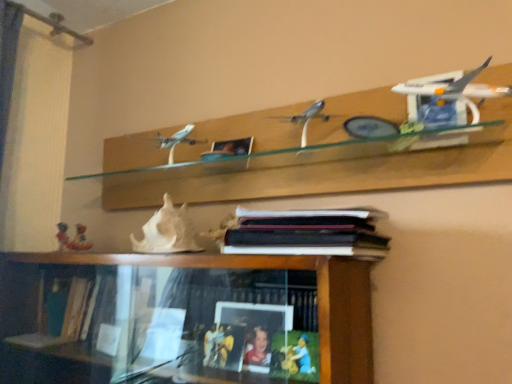
Question: Is matte plastic toy at lower left, which is the first toy in back-to-front order, far from white glossy airplane at upper right?

Choices:
 (A) yes
 (B) no

Answer: (A)

Question: Is matte plastic toy at lower left, the 1th toy from the left, facing away from white glossy airplane at upper right?

Choices:
 (A) no
 (B) yes

Answer: (A)

Question: Would you say white glossy airplane at upper right is part of matte plastic toy at lower left, the 1th toy from the left,'s contents?

Choices:
 (A) yes
 (B) no

Answer: (B)

Question: From a real-world perspective, is matte plastic toy at lower left, the 1th toy from the left, positioned under white glossy airplane at upper right based on gravity?

Choices:
 (A) yes
 (B) no

Answer: (A)

Question: Considering the relative sizes of matte plastic toy at lower left, marked as the 2th toy in a right-to-left arrangement, and white glossy airplane at upper right in the image provided, is matte plastic toy at lower left, marked as the 2th toy in a right-to-left arrangement, shorter than white glossy airplane at upper right?

Choices:
 (A) yes
 (B) no

Answer: (A)

Question: Can you confirm if matte plastic toy at lower left, which is the first toy in back-to-front order, is wider than white glossy airplane at upper right?

Choices:
 (A) yes
 (B) no

Answer: (B)

Question: Does hardcover book at center have a greater height compared to white glossy airplane at upper right?

Choices:
 (A) no
 (B) yes

Answer: (A)

Question: From the image's perspective, is hardcover book at center located beneath white glossy airplane at upper right?

Choices:
 (A) no
 (B) yes

Answer: (B)

Question: From the image's perspective, is hardcover book at center over white glossy airplane at upper right?

Choices:
 (A) no
 (B) yes

Answer: (A)

Question: Is hardcover book at center outside of white glossy airplane at upper right?

Choices:
 (A) yes
 (B) no

Answer: (A)

Question: Does hardcover book at center appear on the left side of white glossy airplane at upper right?

Choices:
 (A) yes
 (B) no

Answer: (A)

Question: Does hardcover book at center come in front of white glossy airplane at upper right?

Choices:
 (A) no
 (B) yes

Answer: (A)

Question: Is white glossy airplane at upper right positioned with its back to hardcover book at center?

Choices:
 (A) yes
 (B) no

Answer: (B)